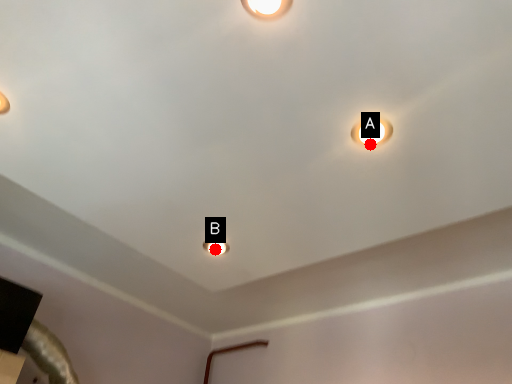
Question: Two points are circled on the image, labeled by A and B beside each circle. Which point is farther to the camera?

Choices:
 (A) A is further
 (B) B is further

Answer: (B)